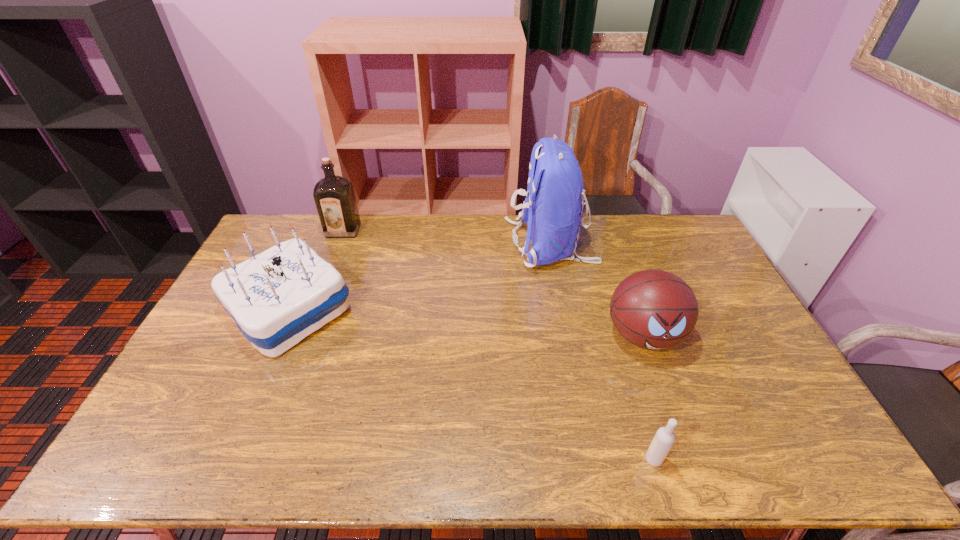
Identify the location of vacant point located 0.130m on the right of the birthday cake. The width and height of the screenshot is (960, 540). (395, 309).

Identify the location of free space located 0.140m on the left of the basketball. (558, 335).

Identify the location of vacant area situated on the left of the vodka. Image resolution: width=960 pixels, height=540 pixels. (475, 460).

This screenshot has width=960, height=540. What are the coordinates of `backpack that is at the far edge` in the screenshot? It's located at (553, 208).

The width and height of the screenshot is (960, 540). I want to click on liquor that is at the far edge, so click(x=334, y=196).

You are a GUI agent. You are given a task and a screenshot of the screen. Output one action in this format:
    pyautogui.click(x=<x>, y=<y>)
    Task: Click on the object located in the near edge section of the desktop
    The height and width of the screenshot is (540, 960).
    Given the screenshot: What is the action you would take?
    pyautogui.click(x=664, y=438)

What are the coordinates of `object that is at the left edge` in the screenshot? It's located at (277, 298).

Identify the location of free space at the far edge. This screenshot has height=540, width=960. (636, 240).

Locate an element on the screen. The image size is (960, 540). vacant space at the near edge is located at coordinates (546, 454).

This screenshot has height=540, width=960. In order to click on vacant space at the far left corner of the desktop in this screenshot , I will do `click(260, 250)`.